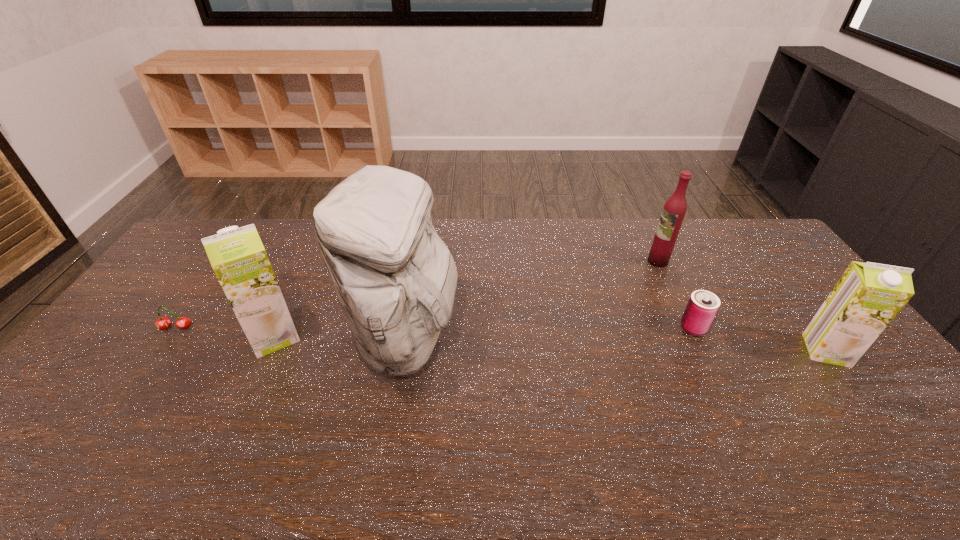
You are a GUI agent. You are given a task and a screenshot of the screen. Output one action in this format:
    pyautogui.click(x=<x>, y=<y>)
    Task: Click on the free space between the backpack and the farthest object
    The width and height of the screenshot is (960, 540).
    Given the screenshot: What is the action you would take?
    click(533, 300)

Where is `free spot between the cherry and the left soya milk`? This screenshot has height=540, width=960. free spot between the cherry and the left soya milk is located at coordinates (225, 332).

The image size is (960, 540). Find the location of `free area in between the shortest object and the taller soya milk`. free area in between the shortest object and the taller soya milk is located at coordinates (225, 332).

Find the location of `empty location between the right soya milk and the fifth tallest object`. empty location between the right soya milk and the fifth tallest object is located at coordinates (759, 339).

Locate an element on the screen. The image size is (960, 540). empty space between the can and the right soya milk is located at coordinates (759, 339).

You are a GUI agent. You are given a task and a screenshot of the screen. Output one action in this format:
    pyautogui.click(x=<x>, y=<y>)
    Task: Click on the object that is the fifth closest to the shorter soya milk
    Image resolution: width=960 pixels, height=540 pixels.
    Given the screenshot: What is the action you would take?
    pyautogui.click(x=162, y=323)

Find the location of a particular element. The width and height of the screenshot is (960, 540). object that can be found as the closest to the third object from left to right is located at coordinates (237, 255).

You are a GUI agent. You are given a task and a screenshot of the screen. Output one action in this format:
    pyautogui.click(x=<x>, y=<y>)
    Task: Click on the vacant point that satisfies the following two spatial constraints: 1. on the front side of the can; 2. on the front-facing side of the tallest object
    
    Given the screenshot: What is the action you would take?
    pyautogui.click(x=699, y=339)

Where is `free space that satisfies the following two spatial constraints: 1. on the label of the farthest object; 2. on the right side of the right soya milk`? This screenshot has height=540, width=960. free space that satisfies the following two spatial constraints: 1. on the label of the farthest object; 2. on the right side of the right soya milk is located at coordinates (701, 350).

In order to click on free spot that satisfies the following two spatial constraints: 1. on the label of the second shortest object; 2. on the left side of the farthest object in this screenshot , I will do `click(689, 327)`.